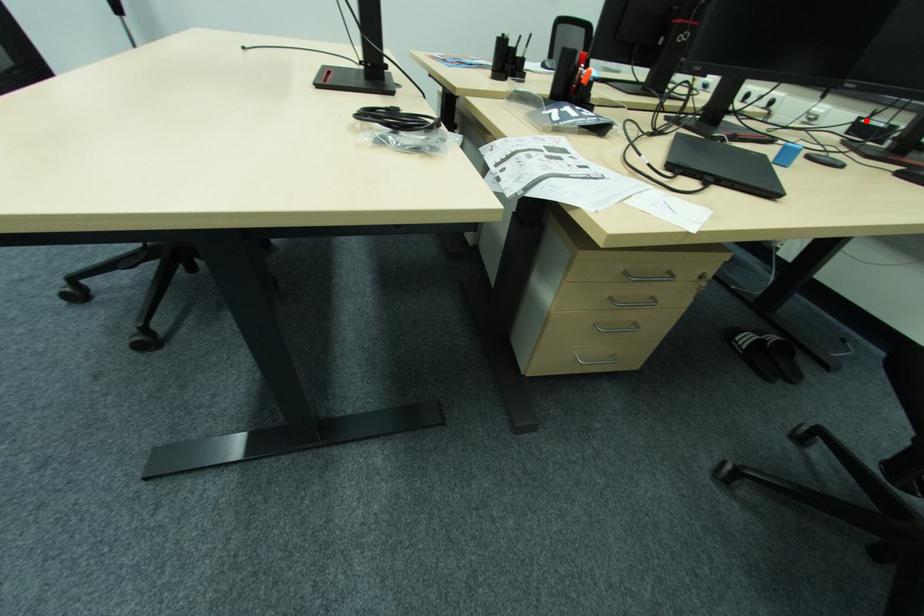
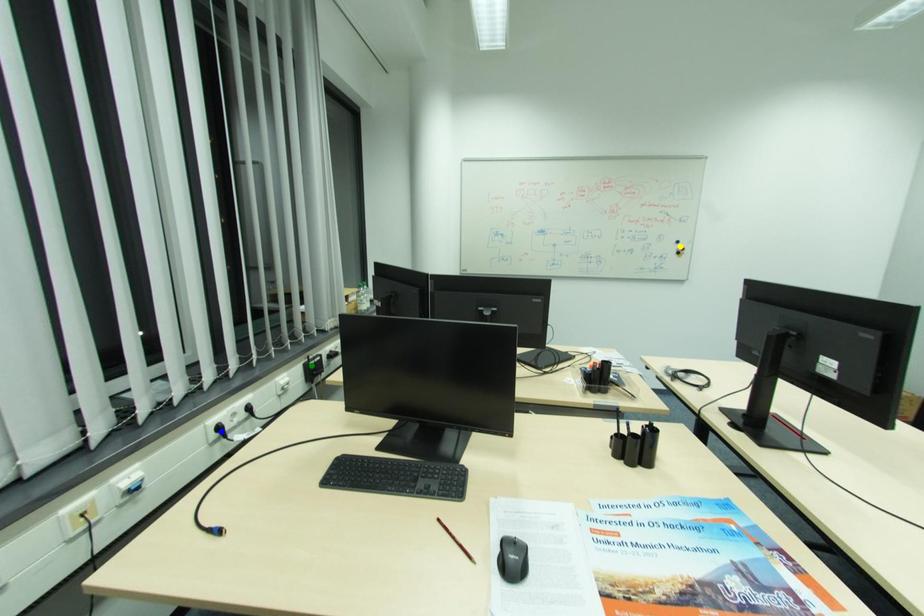
Question: I am providing you with two images of the same scene from different viewpoints. A red point is marked on the first image. You are given multiple points on the second image. In image 2, which mark is for the same physical point as the one in image 1?

Choices:
 (A) blue point
 (B) yellow point
 (C) green point

Answer: (C)